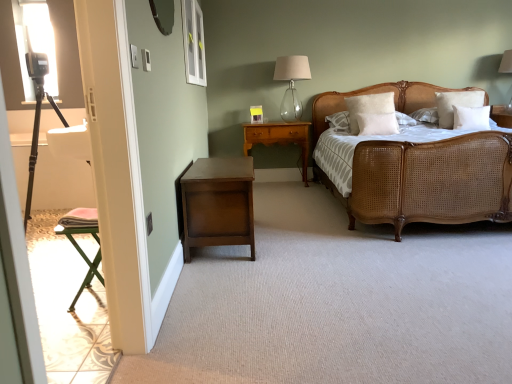
At what (x,y) coordinates should I click in order to perform the action: click on vacant region below wooden nightstand at center, marked as the second nightstand in a front-to-back arrangement (from a real-world perspective). Please return your answer as a coordinate pair (x, y). The image size is (512, 384). Looking at the image, I should click on (279, 182).